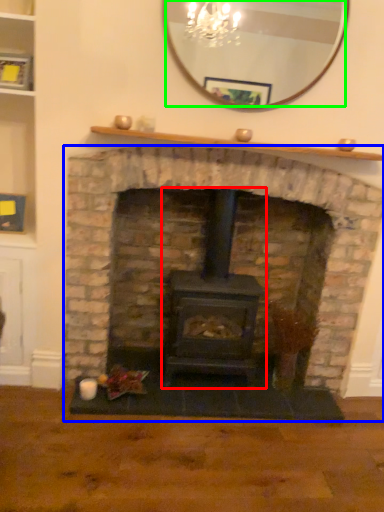
Question: Estimate the real-world distances between objects in this image. Which object is closer to wood burning stove (highlighted by a red box), fireplace (highlighted by a blue box) or mirror (highlighted by a green box)?

Choices:
 (A) fireplace
 (B) mirror

Answer: (A)